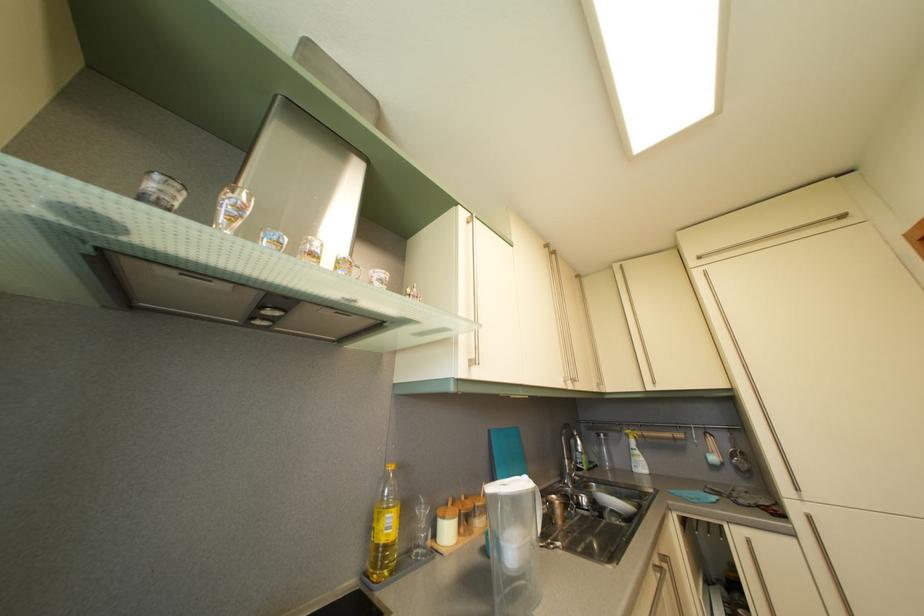
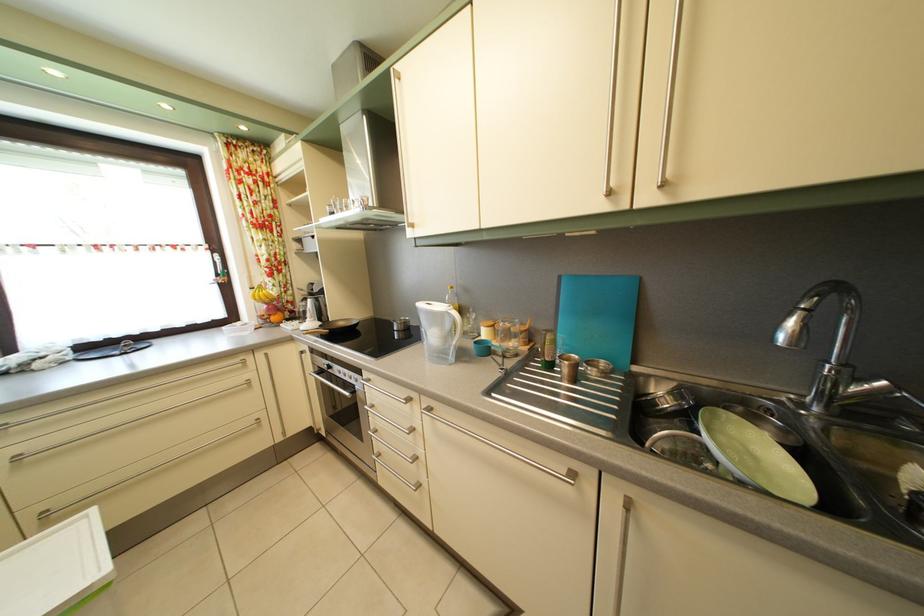
Where in the second image is the point corresponding to pixel 566 519 from the first image?

(574, 378)